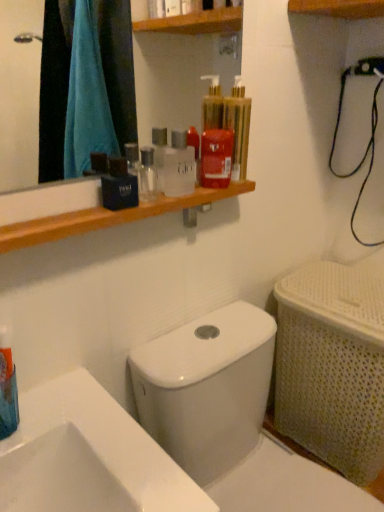
Describe the element at coordinates (238, 127) in the screenshot. I see `translucent plastic mouthwash at upper center, marked as the 1th mouthwash in a right-to-left arrangement` at that location.

At what (x,y) coordinates should I click in order to perform the action: click on white glossy toilet at center. Please return your answer as a coordinate pair (x, y). Looking at the image, I should click on (207, 388).

Looking at this image, measure the distance between blue plastic toothbrush at lower left, the fifth mouthwash viewed from the top, and camera.

They are 25.94 inches apart.

This screenshot has width=384, height=512. What do you see at coordinates (216, 158) in the screenshot?
I see `red glossy mouthwash at upper center, the 4th mouthwash in the bottom-to-top sequence` at bounding box center [216, 158].

Identify the location of wooden shelf at upper center. (111, 217).

The height and width of the screenshot is (512, 384). I want to click on translucent plastic mouthwash at upper center, marked as the 1th mouthwash in a right-to-left arrangement, so click(238, 127).

How far apart are white glossy toilet at center and translucent plastic mouthwash at upper center, marked as the 1th mouthwash in a right-to-left arrangement?

white glossy toilet at center and translucent plastic mouthwash at upper center, marked as the 1th mouthwash in a right-to-left arrangement, are 19.24 inches apart.

Can you confirm if white glossy toilet at center is taller than translucent plastic mouthwash at upper center, positioned as the 1th mouthwash in top-to-bottom order?

Indeed, white glossy toilet at center has a greater height compared to translucent plastic mouthwash at upper center, positioned as the 1th mouthwash in top-to-bottom order.

From the image's perspective, would you say white glossy toilet at center is shown under translucent plastic mouthwash at upper center, marked as the 1th mouthwash in a right-to-left arrangement?

Yes.

From a real-world perspective, which object rests below the other?

white glossy toilet at center is physically lower.

From a real-world perspective, is translucent plastic mouthwash at upper center, positioned as the 5th mouthwash in bottom-to-top order, located higher than transparent plastic mouthwash at upper center, acting as the 3th mouthwash starting from the left?

Yes.

Considering the points (240, 82) and (176, 129), which point is behind, point (240, 82) or point (176, 129)?

The point (176, 129) is farther.

Looking at the image, does translucent plastic mouthwash at upper center, marked as the 5th mouthwash in a left-to-right arrangement, seem bigger or smaller compared to transparent plastic mouthwash at upper center, the 3th mouthwash viewed from the top?

Clearly, translucent plastic mouthwash at upper center, marked as the 5th mouthwash in a left-to-right arrangement, is larger in size than transparent plastic mouthwash at upper center, the 3th mouthwash viewed from the top.

Locate an element on the screen. The image size is (384, 512). mouthwash that is the 2nd object above the transparent plastic mouthwash at upper center, which is counted as the 3th mouthwash, starting from the right (from a real-world perspective) is located at coordinates (238, 127).

Is white glossy toilet at center smaller than blue plastic toothbrush at lower left, placed as the first mouthwash when sorted from bottom to top?

No, white glossy toilet at center is not smaller than blue plastic toothbrush at lower left, placed as the first mouthwash when sorted from bottom to top.

Is white glossy toilet at center next to blue plastic toothbrush at lower left, arranged as the fifth mouthwash when viewed from the right?

No, white glossy toilet at center is not with blue plastic toothbrush at lower left, arranged as the fifth mouthwash when viewed from the right.

Is white glossy toilet at center situated inside blue plastic toothbrush at lower left, arranged as the fifth mouthwash when viewed from the right, or outside?

white glossy toilet at center lies outside blue plastic toothbrush at lower left, arranged as the fifth mouthwash when viewed from the right.

From their relative heights in the image, would you say white glossy toilet at center is taller or shorter than blue plastic toothbrush at lower left, placed as the first mouthwash when sorted from bottom to top?

white glossy toilet at center is taller than blue plastic toothbrush at lower left, placed as the first mouthwash when sorted from bottom to top.

Is blue plastic toothbrush at lower left, arranged as the fifth mouthwash when viewed from the right, at the left side of translucent plastic mouthwash at upper center, positioned as the 5th mouthwash in bottom-to-top order?

Correct, you'll find blue plastic toothbrush at lower left, arranged as the fifth mouthwash when viewed from the right, to the left of translucent plastic mouthwash at upper center, positioned as the 5th mouthwash in bottom-to-top order.

Consider the image. Is translucent plastic mouthwash at upper center, marked as the 5th mouthwash in a left-to-right arrangement, located within blue plastic toothbrush at lower left, placed as the first mouthwash when sorted from bottom to top?

That's incorrect, translucent plastic mouthwash at upper center, marked as the 5th mouthwash in a left-to-right arrangement, is not inside blue plastic toothbrush at lower left, placed as the first mouthwash when sorted from bottom to top.

From the image's perspective, which is below, blue plastic toothbrush at lower left, placed as the first mouthwash when sorted from bottom to top, or translucent plastic mouthwash at upper center, marked as the 5th mouthwash in a left-to-right arrangement?

blue plastic toothbrush at lower left, placed as the first mouthwash when sorted from bottom to top, is shown below in the image.

Which object is further away from the camera, blue plastic toothbrush at lower left, placed as the first mouthwash when sorted from bottom to top, or translucent plastic mouthwash at upper center, marked as the 5th mouthwash in a left-to-right arrangement?

translucent plastic mouthwash at upper center, marked as the 5th mouthwash in a left-to-right arrangement, is further away from the camera.

In the scene shown: Is black matte bag at upper center, placed as the fourth mouthwash when sorted from top to bottom, oriented away from white glossy toilet at center?

black matte bag at upper center, placed as the fourth mouthwash when sorted from top to bottom, does not have its back to white glossy toilet at center.

Is black matte bag at upper center, which appears as the fourth mouthwash when viewed from the right, far from white glossy toilet at center?

No, black matte bag at upper center, which appears as the fourth mouthwash when viewed from the right, is not far from white glossy toilet at center.

From a real-world perspective, is black matte bag at upper center, which appears as the fourth mouthwash when viewed from the right, on white glossy toilet at center?

Yes, from a real-world perspective, black matte bag at upper center, which appears as the fourth mouthwash when viewed from the right, is over white glossy toilet at center

How different are the orientations of white glossy sink at lower left and blue plastic toothbrush at lower left, arranged as the fifth mouthwash when viewed from the right, in degrees?

white glossy sink at lower left and blue plastic toothbrush at lower left, arranged as the fifth mouthwash when viewed from the right, are facing 0.000376 degrees away from each other.

Could you tell me if white glossy sink at lower left is facing blue plastic toothbrush at lower left, arranged as the fifth mouthwash when viewed from the right?

No, white glossy sink at lower left does not turn towards blue plastic toothbrush at lower left, arranged as the fifth mouthwash when viewed from the right.

Considering their positions, is white glossy sink at lower left located in front of or behind blue plastic toothbrush at lower left, placed as the first mouthwash when sorted from bottom to top?

Clearly, white glossy sink at lower left is in front of blue plastic toothbrush at lower left, placed as the first mouthwash when sorted from bottom to top.

Which object is positioned more to the right, white glossy sink at lower left or blue plastic toothbrush at lower left, the fifth mouthwash viewed from the top?

Positioned to the right is white glossy sink at lower left.

Who is smaller, blue plastic toothbrush at lower left, placed as the first mouthwash when sorted from bottom to top, or wooden shelf at upper center?

blue plastic toothbrush at lower left, placed as the first mouthwash when sorted from bottom to top.

Considering their positions, is blue plastic toothbrush at lower left, which ranks as the first mouthwash in left-to-right order, located in front of or behind wooden shelf at upper center?

blue plastic toothbrush at lower left, which ranks as the first mouthwash in left-to-right order, is in front of wooden shelf at upper center.

From the picture: Is blue plastic toothbrush at lower left, the fifth mouthwash viewed from the top, positioned with its back to wooden shelf at upper center?

No.

Find the location of a particular element. Image resolution: width=384 pixels, height=512 pixels. the 1st mouthwash to the left when counting from the white glossy toilet at center is located at coordinates (238, 127).

Starting from the transparent plastic mouthwash at upper center, the 3th mouthwash viewed from the top, which mouthwash is the 2nd one to the right? Please provide its 2D coordinates.

[(238, 127)]

From the image, which object appears to be farther from red glossy mouthwash at upper center, which is the fourth mouthwash in left-to-right order, black matte bag at upper center, placed as the fourth mouthwash when sorted from top to bottom, or transparent plastic mouthwash at upper center, the third mouthwash when ordered from bottom to top?

black matte bag at upper center, placed as the fourth mouthwash when sorted from top to bottom.

Based on the photo, when comparing their distances from translucent plastic mouthwash at upper center, marked as the 1th mouthwash in a right-to-left arrangement, does white glossy sink at lower left or transparent plastic mouthwash at upper center, which is counted as the 3th mouthwash, starting from the right, seem further?

white glossy sink at lower left is positioned further to the anchor translucent plastic mouthwash at upper center, marked as the 1th mouthwash in a right-to-left arrangement.

Estimate the real-world distances between objects in this image. Which object is further from wooden shelf at upper center, translucent plastic mouthwash at upper center, marked as the 1th mouthwash in a right-to-left arrangement, or red glossy mouthwash at upper center, the second mouthwash positioned from the right?

translucent plastic mouthwash at upper center, marked as the 1th mouthwash in a right-to-left arrangement, lies further to wooden shelf at upper center than the other object.

Which object lies nearer to the anchor point white glossy toilet at center, blue plastic toothbrush at lower left, arranged as the fifth mouthwash when viewed from the right, or white glossy sink at lower left?

Based on the image, white glossy sink at lower left appears to be nearer to white glossy toilet at center.

Which object lies nearer to the anchor point transparent plastic mouthwash at upper center, acting as the 3th mouthwash starting from the left, red glossy mouthwash at upper center, which is counted as the second mouthwash, starting from the top, or translucent plastic mouthwash at upper center, positioned as the 5th mouthwash in bottom-to-top order?

Among the two, red glossy mouthwash at upper center, which is counted as the second mouthwash, starting from the top, is located nearer to transparent plastic mouthwash at upper center, acting as the 3th mouthwash starting from the left.

When comparing their distances from black matte bag at upper center, the 2th mouthwash from the left, does wooden shelf at upper center or blue plastic toothbrush at lower left, placed as the first mouthwash when sorted from bottom to top, seem closer?

wooden shelf at upper center.

Based on their spatial positions, is wooden shelf at upper center or blue plastic toothbrush at lower left, the fifth mouthwash viewed from the top, further from white glossy toilet at center?

Based on the image, blue plastic toothbrush at lower left, the fifth mouthwash viewed from the top, appears to be further to white glossy toilet at center.

Considering their positions, is transparent plastic mouthwash at upper center, acting as the 3th mouthwash starting from the left, positioned further to red glossy mouthwash at upper center, which is counted as the second mouthwash, starting from the top, than white glossy sink at lower left?

Based on the image, white glossy sink at lower left appears to be further to red glossy mouthwash at upper center, which is counted as the second mouthwash, starting from the top.

Where is `sink between black matte bag at upper center, which appears as the fourth mouthwash when viewed from the right, and white glossy toilet at center, in the vertical direction`? The image size is (384, 512). sink between black matte bag at upper center, which appears as the fourth mouthwash when viewed from the right, and white glossy toilet at center, in the vertical direction is located at coordinates (88, 456).

At what (x,y) coordinates should I click in order to perform the action: click on ledge that lies between translucent plastic mouthwash at upper center, marked as the 5th mouthwash in a left-to-right arrangement, and blue plastic toothbrush at lower left, which ranks as the first mouthwash in left-to-right order, from top to bottom. Please return your answer as a coordinate pair (x, y). Image resolution: width=384 pixels, height=512 pixels. Looking at the image, I should click on (111, 217).

Locate an element on the screen. ledge between black matte bag at upper center, which appears as the fourth mouthwash when viewed from the right, and translucent plastic mouthwash at upper center, marked as the 5th mouthwash in a left-to-right arrangement is located at coordinates (111, 217).

Where is `ledge that lies between translucent plastic mouthwash at upper center, positioned as the 1th mouthwash in top-to-bottom order, and white glossy toilet at center from top to bottom`? The height and width of the screenshot is (512, 384). ledge that lies between translucent plastic mouthwash at upper center, positioned as the 1th mouthwash in top-to-bottom order, and white glossy toilet at center from top to bottom is located at coordinates (111, 217).